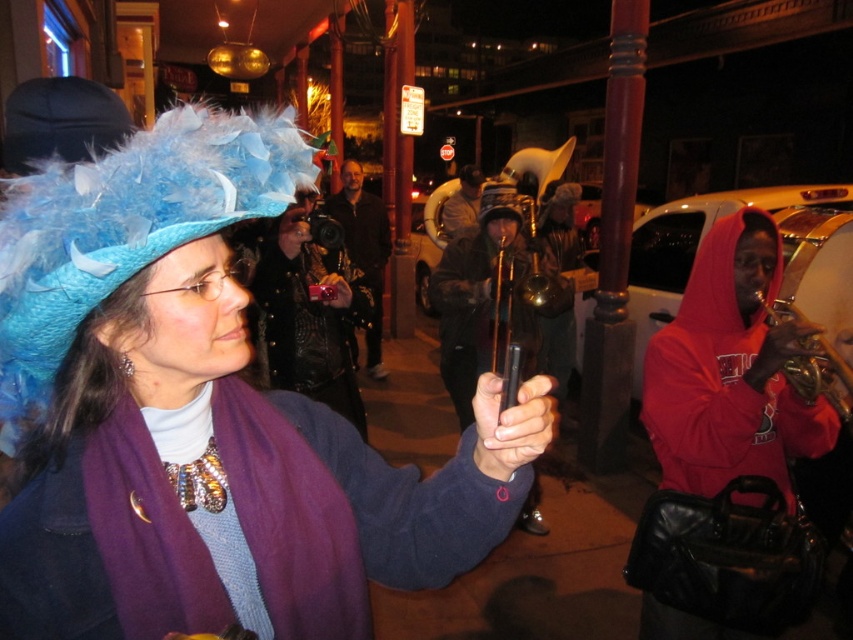
You are standing at the point with coordinates point [134,138] and want to walk to the point with coordinates point [509,184]. Which direction should you move in relation to the scene?

You should move backward because point [134,138] is in front of point [509,184], so to reach the latter, you need to move in the opposite direction towards it.